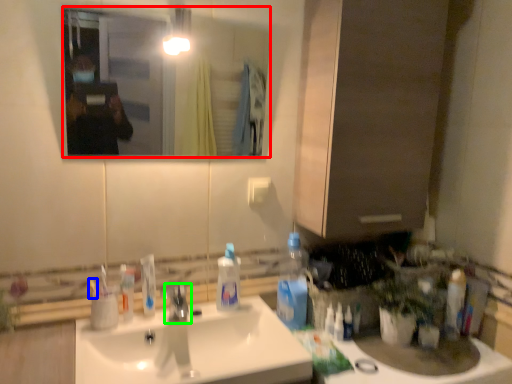
Question: Which object is positioned closest to mirror (highlighted by a red box)? Select from toothbrush (highlighted by a blue box) and tap (highlighted by a green box).

Choices:
 (A) toothbrush
 (B) tap

Answer: (B)